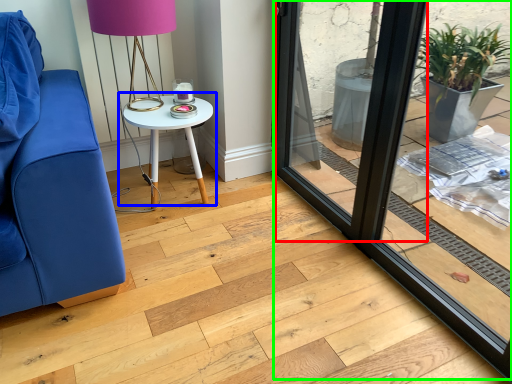
Question: Considering the real-world distances, which object is closest to screen door (highlighted by a red box)? table (highlighted by a blue box) or window frame (highlighted by a green box).

Choices:
 (A) table
 (B) window frame

Answer: (B)